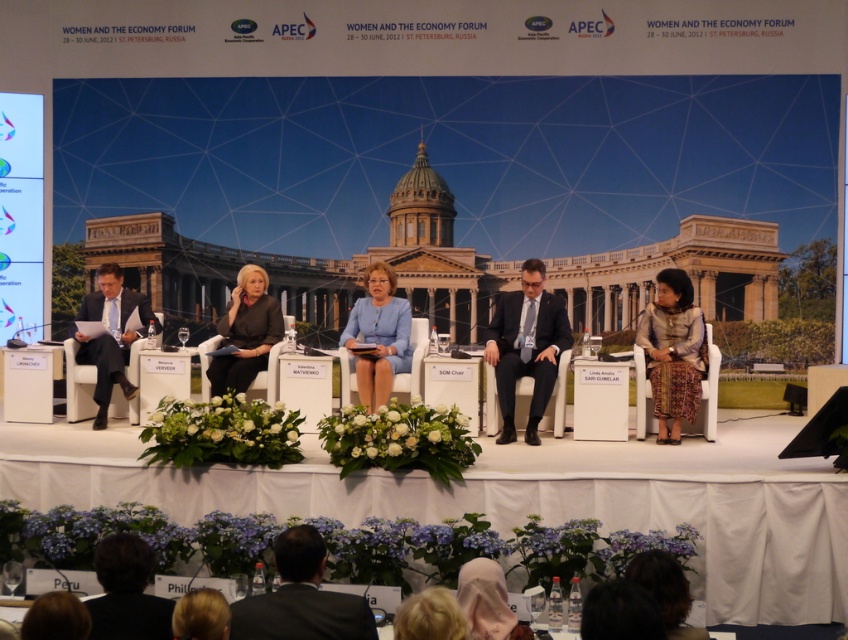
Question: Which is farther from the dark blue suit at center?

Choices:
 (A) dark gray suit at center
 (B) blue fabric dress at center
 (C) dark suit at left

Answer: (C)

Question: Which point appears farthest from the camera in this image?

Choices:
 (A) (109, 285)
 (B) (353, 320)
 (C) (252, 356)

Answer: (A)

Question: Does silk skirt at right appear on the right side of blue fabric dress at center?

Choices:
 (A) no
 (B) yes

Answer: (B)

Question: Based on their relative distances, which object is farther from the dark gray suit at center?

Choices:
 (A) dark blue suit at center
 (B) silk skirt at right
 (C) blue fabric dress at center
 (D) dark suit at left

Answer: (B)

Question: Is the position of silk skirt at right more distant than that of dark suit at left?

Choices:
 (A) no
 (B) yes

Answer: (A)

Question: Does dark blue suit at center have a greater width compared to blue fabric dress at center?

Choices:
 (A) no
 (B) yes

Answer: (B)